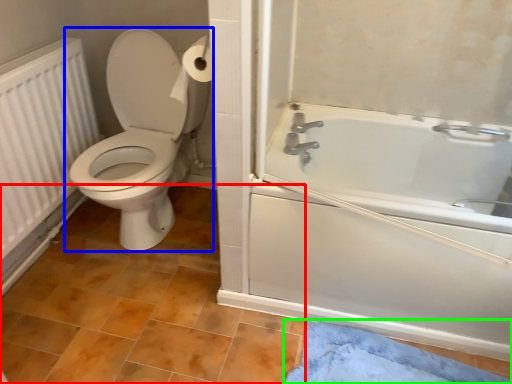
Question: Which object is the farthest from tile (highlighted by a red box)? Choose among these: toilet (highlighted by a blue box) or bath mat (highlighted by a green box).

Choices:
 (A) toilet
 (B) bath mat

Answer: (B)